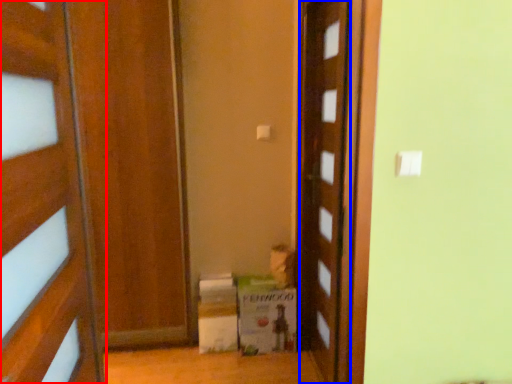
Question: Which point is closer to the camera, door (highlighted by a red box) or door (highlighted by a blue box)?

Choices:
 (A) door
 (B) door

Answer: (A)